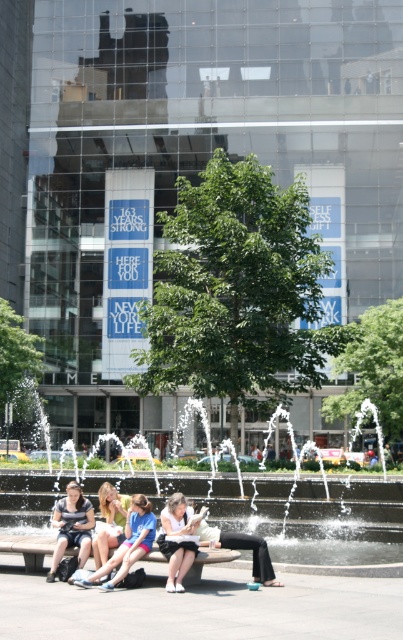
Can you confirm if denim shorts at lower left is smaller than denim jacket at lower left?

No.

Can you confirm if denim shorts at lower left is positioned below denim jacket at lower left?

No.

Does point (116, 554) lie in front of point (64, 513)?

Yes, it is in front of point (64, 513).

What are the coordinates of `denim shorts at lower left` in the screenshot? It's located at (128, 544).

In the scene shown: Can you confirm if denim jacket at lower left is positioned below blonde hair at center?

Indeed, denim jacket at lower left is positioned under blonde hair at center.

Is point (87, 504) closer to viewer compared to point (101, 557)?

No, (87, 504) is further to viewer.

Is point (56, 564) farther from camera compared to point (110, 499)?

No, (56, 564) is in front of (110, 499).

Find the location of a particular element. denim jacket at lower left is located at coordinates (72, 525).

Looking at this image, is white cotton shirt at center further to camera compared to light beige pants at center?

That is False.

Which of these two, white cotton shirt at center or light beige pants at center, stands taller?

With more height is white cotton shirt at center.

Find the location of a particular element. This screenshot has width=403, height=640. white cotton shirt at center is located at coordinates (178, 538).